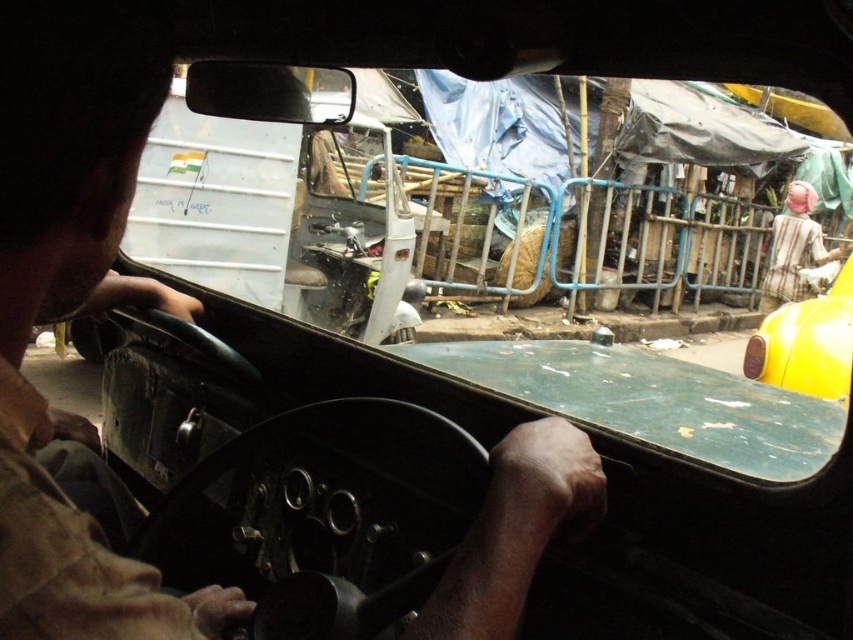
Question: From the image, what is the correct spatial relationship of yellow matte taxi at right in relation to striped fabric headscarf at right?

Choices:
 (A) left
 (B) right

Answer: (A)

Question: Among these points, which one is nearest to the camera?

Choices:
 (A) (784, 230)
 (B) (831, 316)

Answer: (B)

Question: Does yellow matte taxi at right appear over striped fabric headscarf at right?

Choices:
 (A) no
 (B) yes

Answer: (A)

Question: Among these objects, which one is farthest from the camera?

Choices:
 (A) striped fabric headscarf at right
 (B) yellow matte taxi at right

Answer: (A)

Question: Which of the following is the closest to the observer?

Choices:
 (A) [x=842, y=374]
 (B) [x=793, y=230]

Answer: (A)

Question: Does yellow matte taxi at right appear on the right side of striped fabric headscarf at right?

Choices:
 (A) no
 (B) yes

Answer: (A)